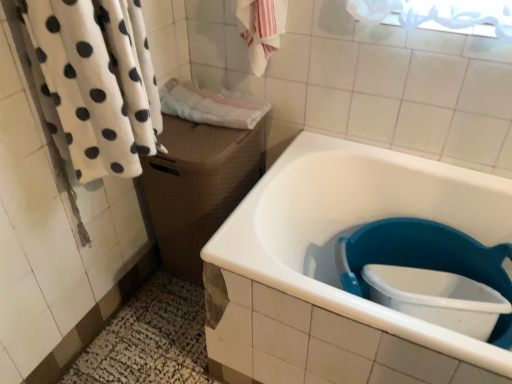
At what (x,y) coordinates should I click in order to perform the action: click on vacant space situated above brown woven box at center (from a real-world perspective). Please return your answer as a coordinate pair (x, y). This screenshot has height=384, width=512. Looking at the image, I should click on (197, 133).